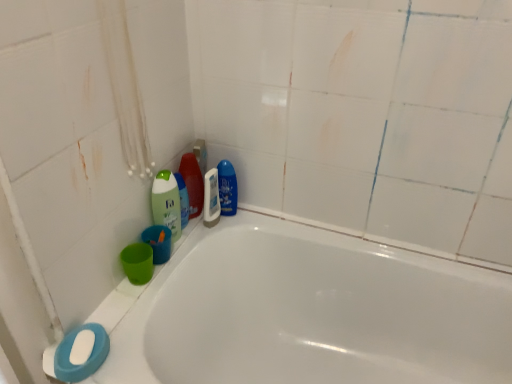
Find the location of `free space in front of translucent plastic bottle at upper center, the third cleaning product when ordered from left to right`. free space in front of translucent plastic bottle at upper center, the third cleaning product when ordered from left to right is located at coordinates (190, 240).